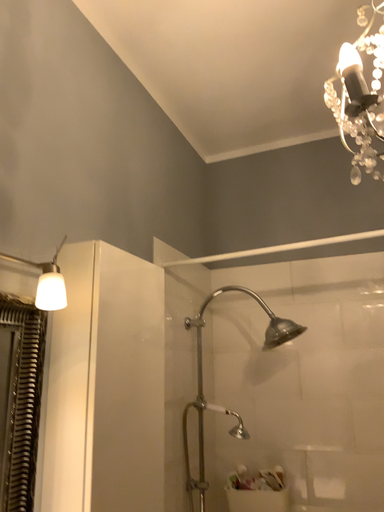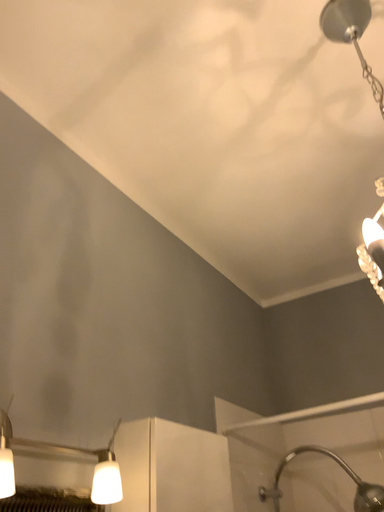
Question: How did the camera likely rotate when shooting the video?

Choices:
 (A) rotated upward
 (B) rotated downward

Answer: (A)